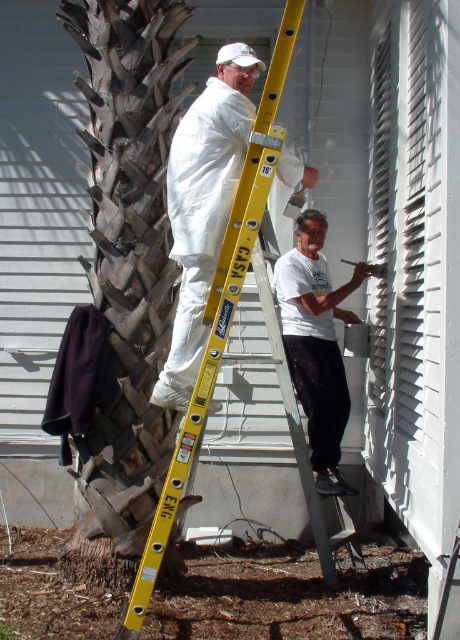
You are a delivery person trying to deliver a package to the house. The white matte coveralls at center is blocking your path to the yellow metallic ladder at center. Can you go around the coveralls to reach the ladder?

The yellow metallic ladder at center is behind the white matte coveralls at center, so you can go around the coveralls to reach the ladder since the ladder is positioned behind it.

You are standing at the origin point in the image. There are two points marked in the scene. Which of the two points, point (172, 20) or point (218, 83), is closer to you?

Point (218, 83) is closer to you because point (172, 20) is behind point (218, 83).